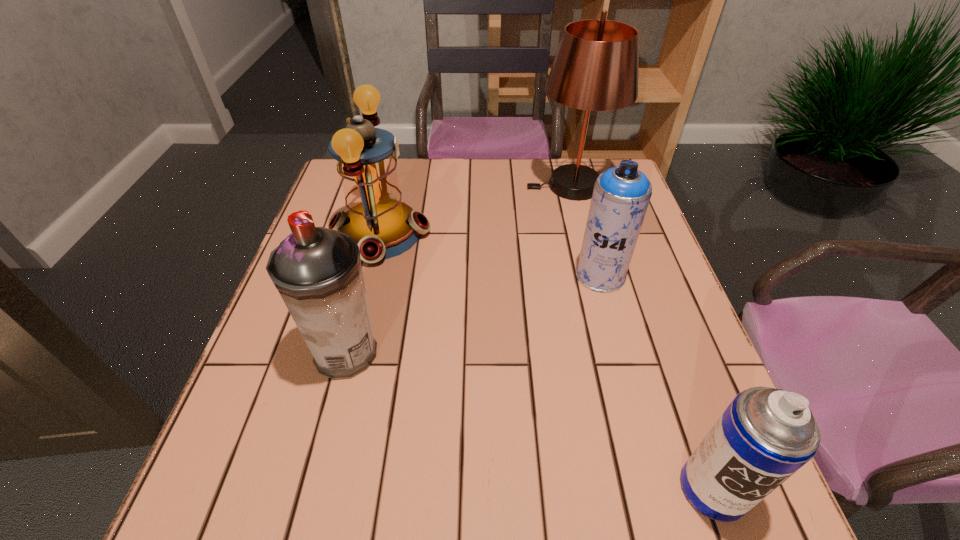
The width and height of the screenshot is (960, 540). I want to click on vacant space positioned 0.060m on the right of the fourth farthest object, so click(412, 353).

The height and width of the screenshot is (540, 960). I want to click on blank space located on the left of the farthest aerosol can, so click(541, 275).

Identify the location of lampshade present at the far edge. The width and height of the screenshot is (960, 540). (595, 68).

What are the coordinates of `lantern located at the far edge` in the screenshot? It's located at (383, 227).

The width and height of the screenshot is (960, 540). I want to click on object that is at the near edge, so click(x=765, y=435).

At what (x,y) coordinates should I click in order to perform the action: click on lantern that is positioned at the left edge. Please return your answer as a coordinate pair (x, y). This screenshot has width=960, height=540. Looking at the image, I should click on (383, 227).

Find the location of a particular element. The image size is (960, 540). aerosol can located in the left edge section of the desktop is located at coordinates (317, 271).

Identify the location of lampshade that is at the right edge. (595, 68).

Image resolution: width=960 pixels, height=540 pixels. What are the coordinates of `object present at the far left corner` in the screenshot? It's located at (383, 227).

Find the location of `object that is at the far right corner`. object that is at the far right corner is located at coordinates click(x=595, y=68).